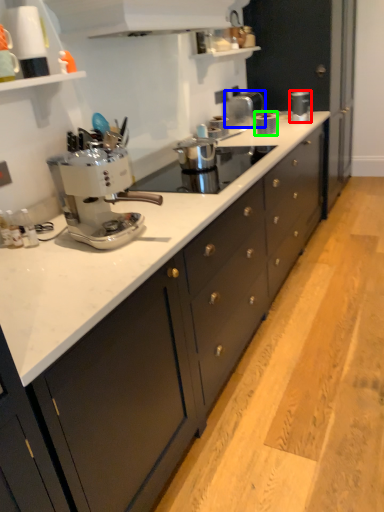
Question: Based on their relative distances, which object is farther from kitchen appliance (highlighted by a red box)? Choose from appliance (highlighted by a blue box) and kitchen appliance (highlighted by a green box).

Choices:
 (A) appliance
 (B) kitchen appliance

Answer: (B)